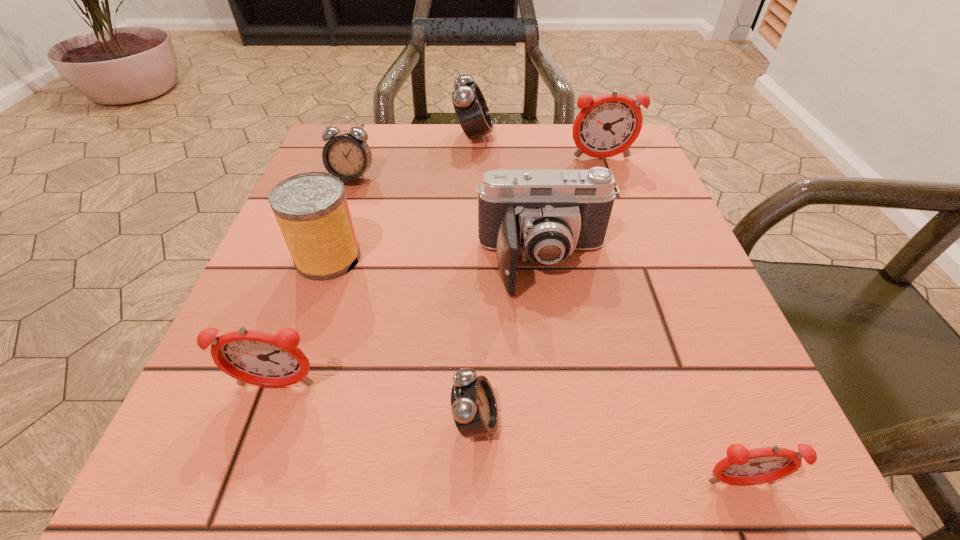
I want to click on free region at the far left corner, so click(389, 156).

Where is `vacant space at the far right corner of the desktop`? Image resolution: width=960 pixels, height=540 pixels. vacant space at the far right corner of the desktop is located at coordinates (630, 163).

Where is `unoccupied area between the farthest object and the second nearest alarm clock`? This screenshot has height=540, width=960. unoccupied area between the farthest object and the second nearest alarm clock is located at coordinates (474, 279).

Find the location of `empty space that is in between the farthest reddish-pink alarm clock and the smallest reddish-pink alarm clock`. empty space that is in between the farthest reddish-pink alarm clock and the smallest reddish-pink alarm clock is located at coordinates (670, 321).

Where is `free point between the smallest reddish-pink alarm clock and the fourth farthest alarm clock`? free point between the smallest reddish-pink alarm clock and the fourth farthest alarm clock is located at coordinates (508, 434).

You are a GUI agent. You are given a task and a screenshot of the screen. Output one action in this format:
    pyautogui.click(x=<x>, y=<y>)
    Task: Click on the empty space between the farthest alarm clock and the second farthest reddish-pink alarm clock
    This screenshot has height=540, width=960.
    Given the screenshot: What is the action you would take?
    pyautogui.click(x=375, y=261)

Locate an element on the screen. unoccupied position between the smallest white alarm clock and the can is located at coordinates (402, 339).

Find the location of `vacant space in between the second nearest alarm clock and the can`. vacant space in between the second nearest alarm clock and the can is located at coordinates (402, 339).

Image resolution: width=960 pixels, height=540 pixels. In order to click on unoccupied position between the farthest reddish-pink alarm clock and the farthest object in this screenshot , I will do `click(538, 147)`.

Find the location of `blank region between the second smallest reddish-pink alarm clock and the nearest reddish-pink alarm clock`. blank region between the second smallest reddish-pink alarm clock and the nearest reddish-pink alarm clock is located at coordinates (508, 434).